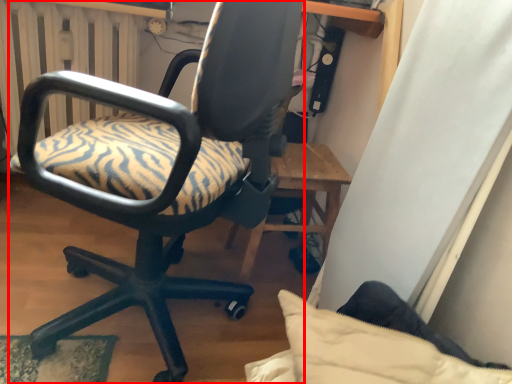
Question: From the image's perspective, where is chair (annotated by the red box) located in relation to radiator in the image?

Choices:
 (A) below
 (B) above

Answer: (A)